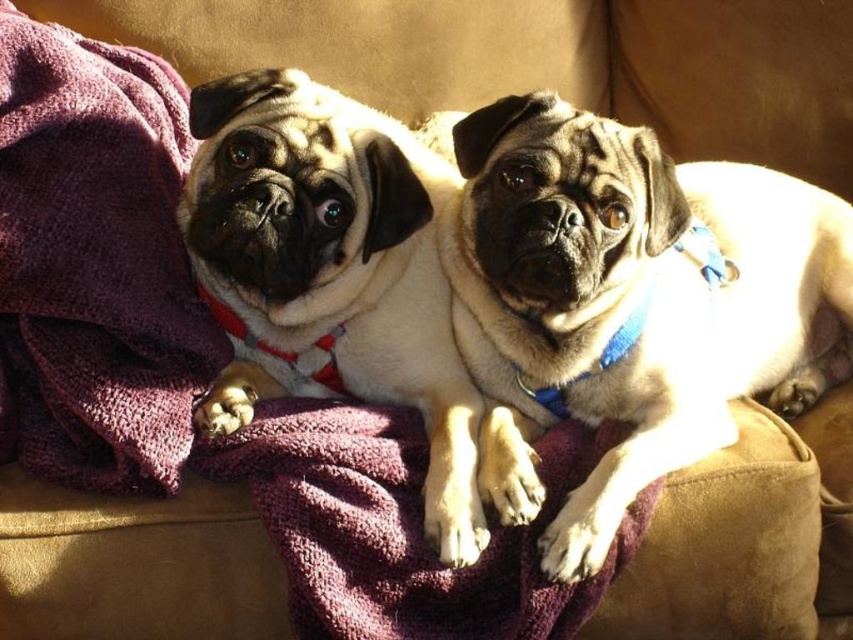
You are a photographer setting up for a pet photoshoot. You need to place a small light source at point [630,301] to highlight the matte beige pug at center. Where should you position the light relative to the couch and the pug?

The point [630,301] is where the matte beige pug at center is located, so you should position the light directly above or near that coordinate to effectively highlight the pug.

You are a photographer setting up for a pet photo shoot. You notice the smooth beige dog at center and the purple soft towel at left in the scene. To ensure the dog stays warm during the shoot, where should you place the heating pad?

The smooth beige dog at center is positioned under the purple soft towel at left, so placing the heating pad under the purple soft towel at left would keep the dog warm.

You are a photographer setting up a shoot in the living room. You need to place a small stool between the smooth beige dog at center and the purple soft towel at left. Based on their positions, which side of the stool should face the camera to ensure both the dog and the towel are visible in the shot?

The stool should be placed between the smooth beige dog at center and the purple soft towel at left. Since the smooth beige dog at center is on the right side of the purple soft towel at left, positioning the stool so that its right side faces the camera will keep both the dog and the towel in view.